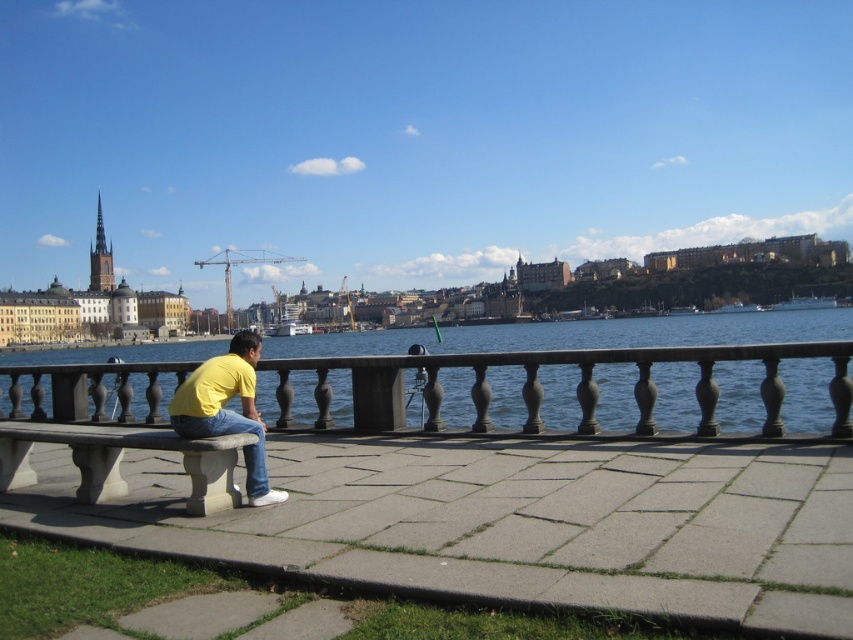
Does blue water at center have a lesser height compared to yellow matte shirt at center?

Incorrect, blue water at center's height does not fall short of yellow matte shirt at center's.

Who is positioned more to the right, blue water at center or yellow matte shirt at center?

blue water at center

Is point (604, 396) positioned behind point (204, 412)?

Yes, it is.

Identify the location of blue water at center. (596, 352).

Which is below, gray stone bench at lower left or yellow matte shirt at center?

gray stone bench at lower left is lower down.

Between point (155, 442) and point (256, 413), which one is positioned behind?

Positioned behind is point (256, 413).

I want to click on gray stone bench at lower left, so [120, 458].

In order to click on gray stone bench at lower left in this screenshot , I will do `click(120, 458)`.

Who is shorter, blue water at center or gray stone bench at lower left?

Standing shorter between the two is gray stone bench at lower left.

Can you confirm if blue water at center is shorter than gray stone bench at lower left?

No, blue water at center is not shorter than gray stone bench at lower left.

Find the location of a particular element. blue water at center is located at coordinates pyautogui.click(x=596, y=352).